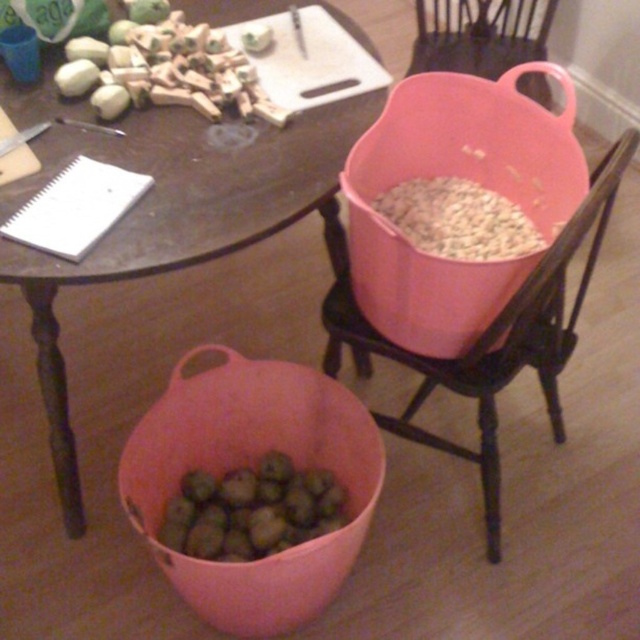
Question: Does matte wood table at center appear over green matte wooden pieces at upper left?

Choices:
 (A) yes
 (B) no

Answer: (B)

Question: Based on their relative distances, which object is farther from the white matte seeds at upper right?

Choices:
 (A) green matte nuts at lower center
 (B) pink plastic bucket at upper center

Answer: (A)

Question: Does matte wood table at center appear under pink plastic bucket at upper right?

Choices:
 (A) no
 (B) yes

Answer: (B)

Question: Which point is closer to the camera?

Choices:
 (A) (486, 538)
 (B) (282, 392)

Answer: (B)

Question: Is pink plastic bucket at upper right to the left of pink plastic bucket at upper center from the viewer's perspective?

Choices:
 (A) yes
 (B) no

Answer: (A)

Question: Which point is closer to the camera taking this photo?

Choices:
 (A) click(243, 109)
 (B) click(209, 547)

Answer: (A)